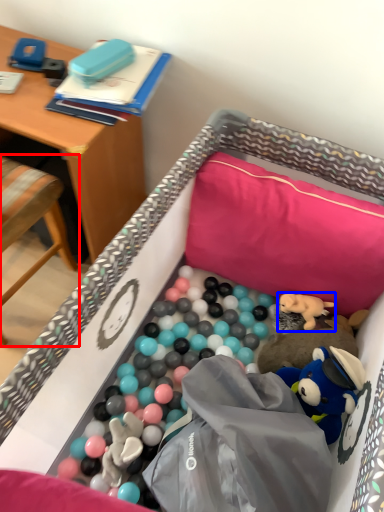
Question: Which of the following is the closest to the observer, chair (highlighted by a red box) or toy (highlighted by a blue box)?

Choices:
 (A) chair
 (B) toy

Answer: (A)